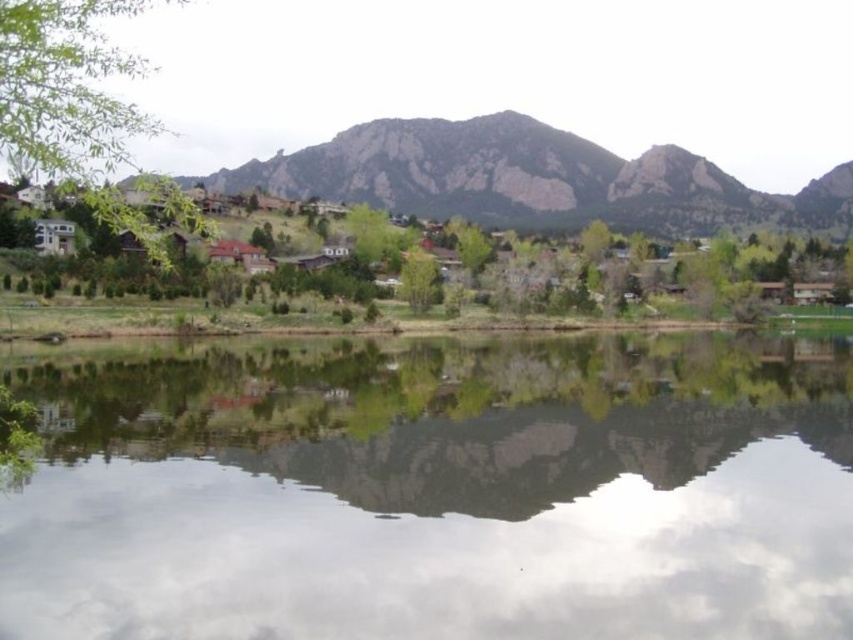
Which of these two, green leafy tree at center or green matte tree at center, stands taller?

Standing taller between the two is green leafy tree at center.

Who is more distant from viewer, (123, 234) or (408, 304)?

Point (123, 234)

This screenshot has width=853, height=640. What are the coordinates of `green leafy tree at center` in the screenshot? It's located at [x=820, y=208].

Between point (434, 150) and point (3, 108), which one is positioned in front?

Point (3, 108) is more forward.

Between point (335, 182) and point (62, 154), which one is positioned behind?

The point (335, 182) is more distant.

The width and height of the screenshot is (853, 640). In order to click on rugged brown mountain at center in this screenshot , I will do `click(531, 179)`.

Is transparent water at center below green leafy tree at left?

Yes, transparent water at center is below green leafy tree at left.

Is point (670, 541) more distant than point (3, 13)?

Yes, it is.

Between point (363, 403) and point (142, 227), which one is positioned behind?

Positioned behind is point (363, 403).

Find the location of a particular element. transparent water at center is located at coordinates (434, 488).